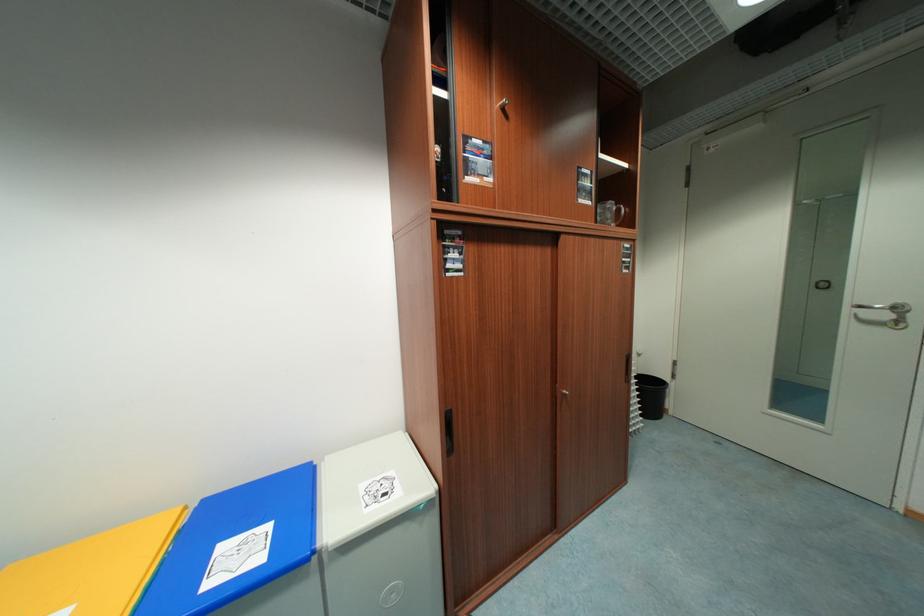
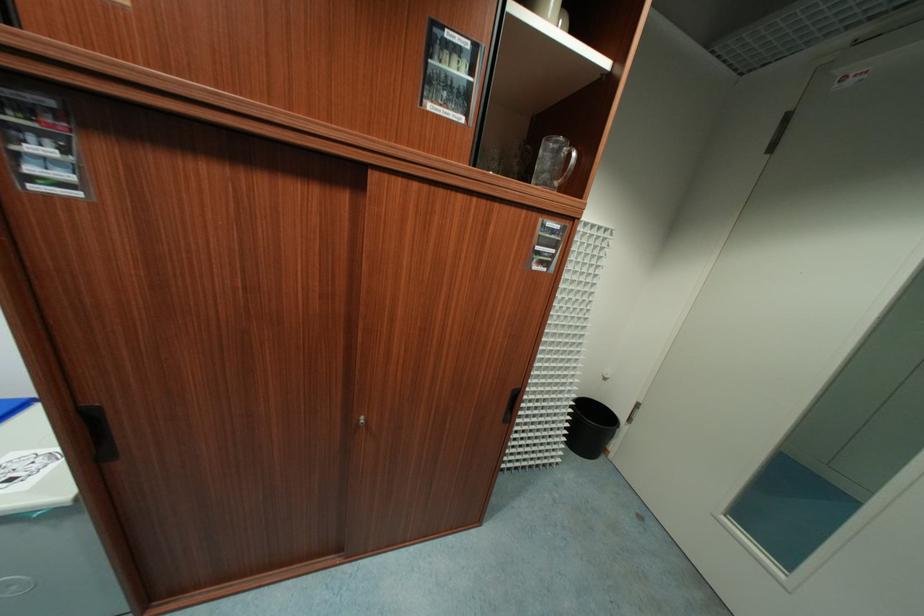
Find the pixel in the second image that matches pixel 569 392 in the first image.

(368, 419)